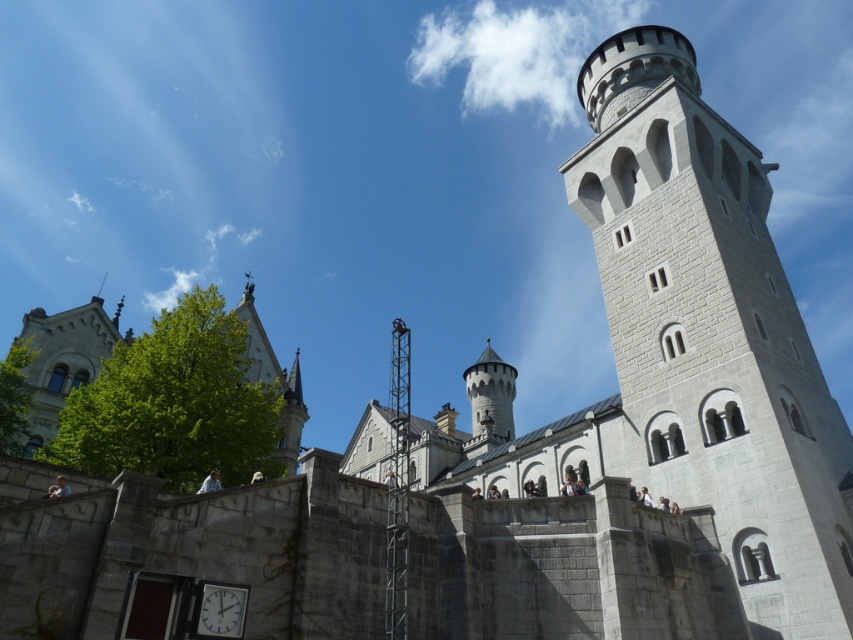
You are standing in front of the castle and see a point marked at coordinates (711,333). Based on the castle layout, which part of the castle does this point belong to?

The point at coordinates (711,333) is located on the white stone tower at upper right.

You are a tourist standing in front of the castle. You see two points marked on the castle wall. The first point is at coordinate point (630,380) and the second is at point (204,584). Which point is closer to you?

Point (204,584) is closer to you because it is not as far as point (630,380) which is further away according to the description.

You are a maintenance worker needing to reach the white plastic clock at lower center from the white stone tower at upper right. The ladder you have is 40 meters long. Will it be long enough to safely reach the clock?

The distance between the white stone tower at upper right and the white plastic clock at lower center is 41.09 meters. Since the ladder is only 40 meters long, it is not long enough to safely reach the clock.